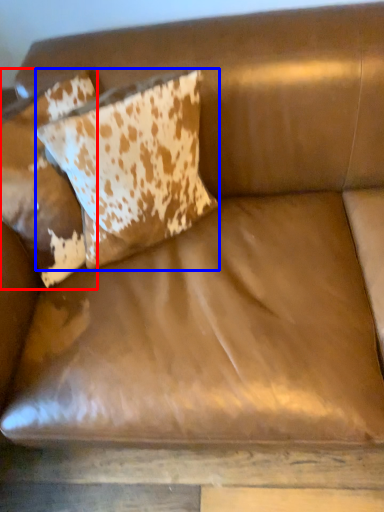
Question: Which of the following is the farthest to the observer, pillow (highlighted by a red box) or pillow (highlighted by a blue box)?

Choices:
 (A) pillow
 (B) pillow

Answer: (A)